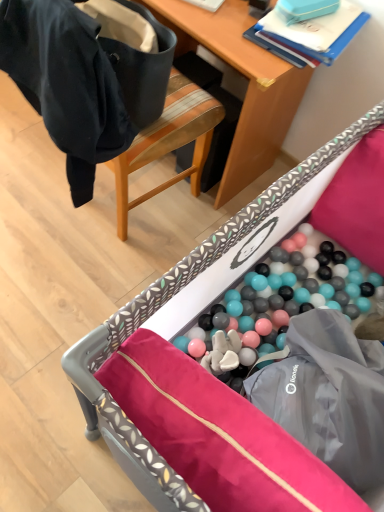
What are the coordinates of `vacant space to the left of black fabric chair at upper left` in the screenshot? It's located at (28, 169).